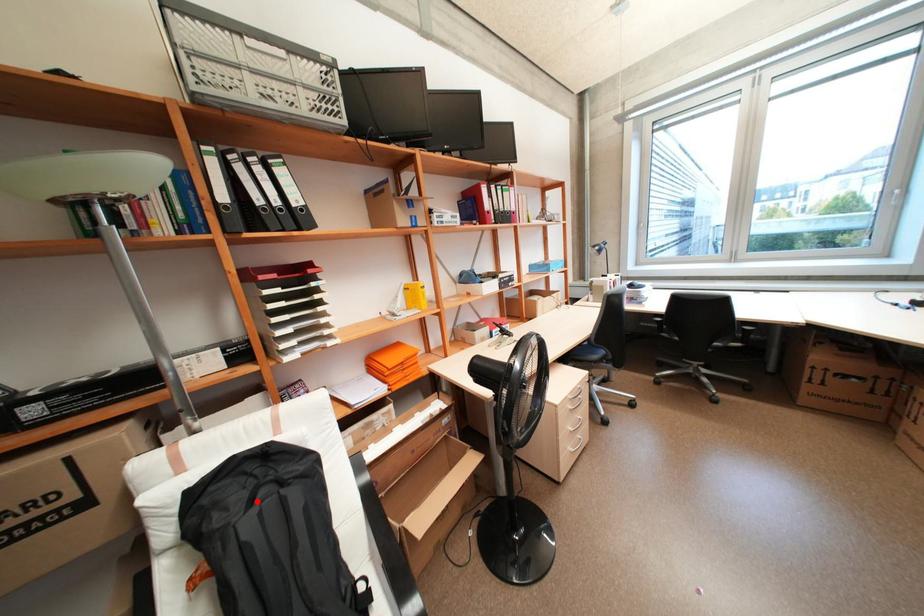
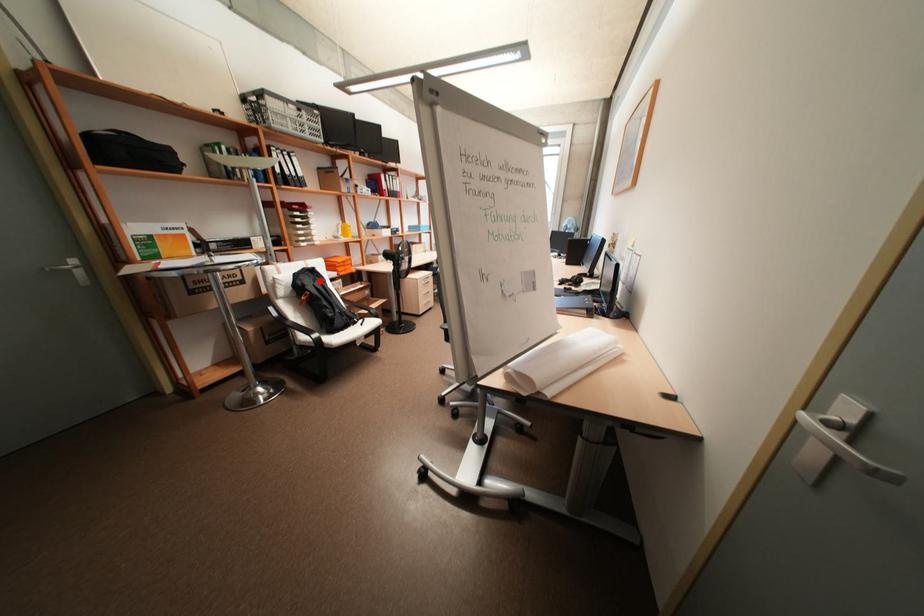
I am providing you with two images of the same scene from different viewpoints. A red point is marked on the first image and another point is marked on the second image. Are the points marked in image1 and image2 representing the same 3D position?

Yes